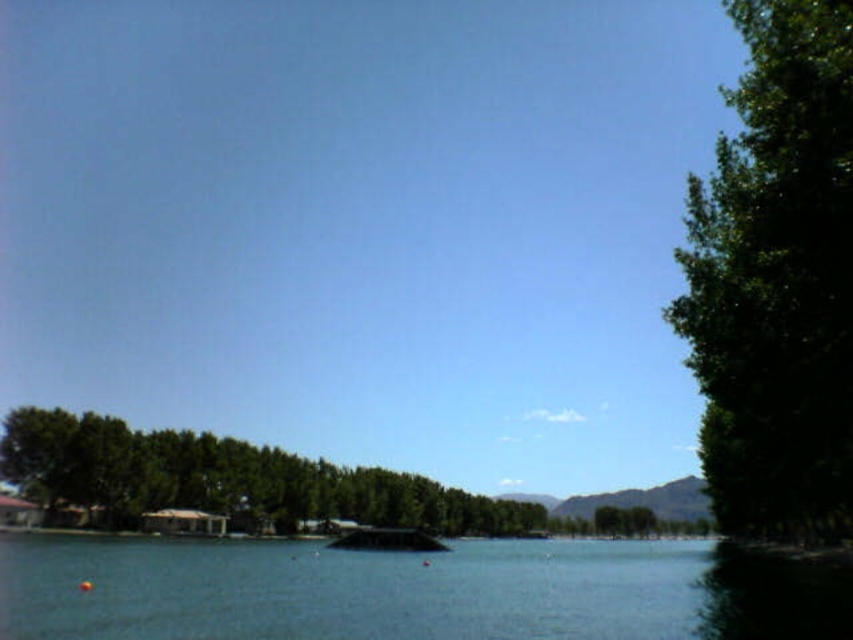
Looking at this image, you are an environmental scientist examining the lake area. You notice the green leafy tree at right and the green leafy trees at center. Which of these has a taller height?

The green leafy tree at right has a greater height compared to the green leafy trees at center, so the green leafy tree at right is taller.

You are standing at the center of the lakeside and see the point marked at coordinates point (776, 280). What object is located at that point?

The point (776, 280) marks a green leafy tree at the right side of the lakeside scene.